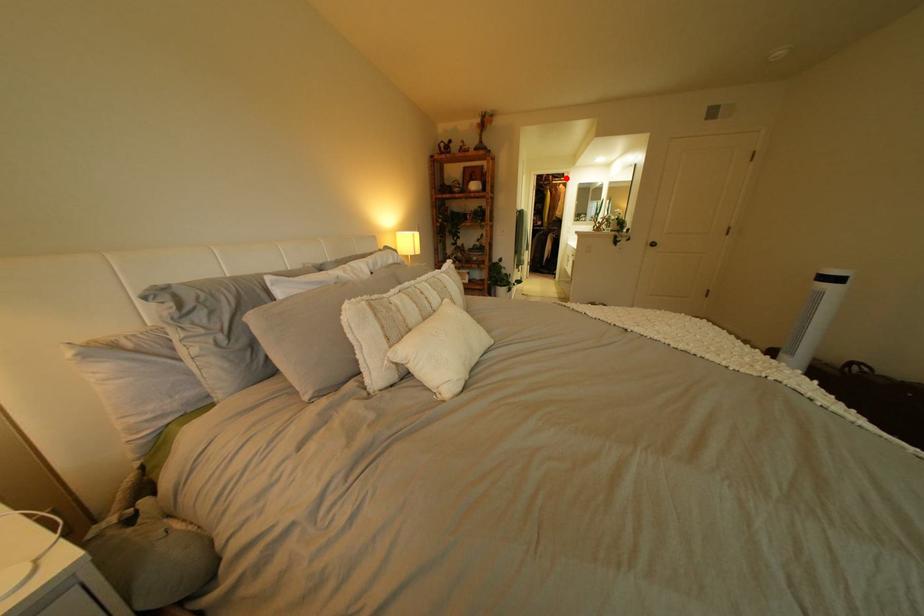
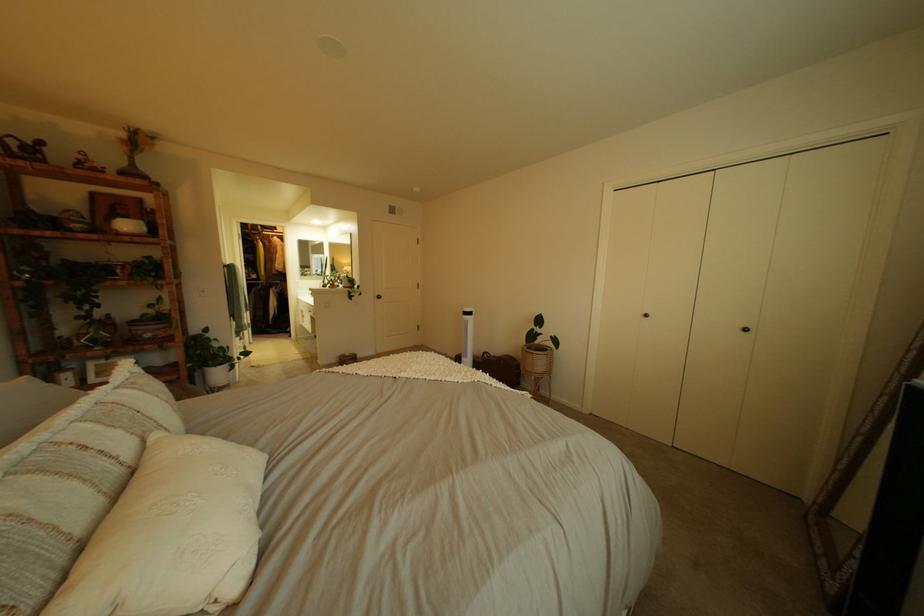
Locate, in the second image, the point that corresponds to the highlighted location in the first image.

(274, 228)